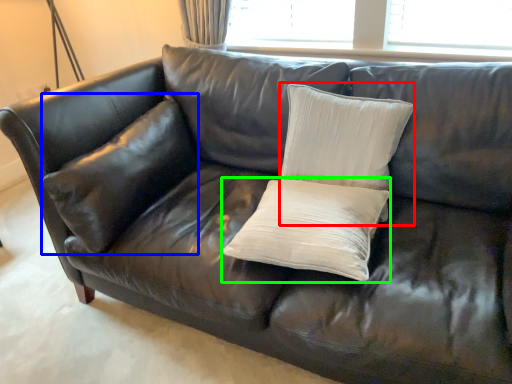
Question: Which object is positioned closest to pillow (highlighted by a red box)? Select from pillow (highlighted by a blue box) and pillow (highlighted by a green box).

Choices:
 (A) pillow
 (B) pillow

Answer: (B)